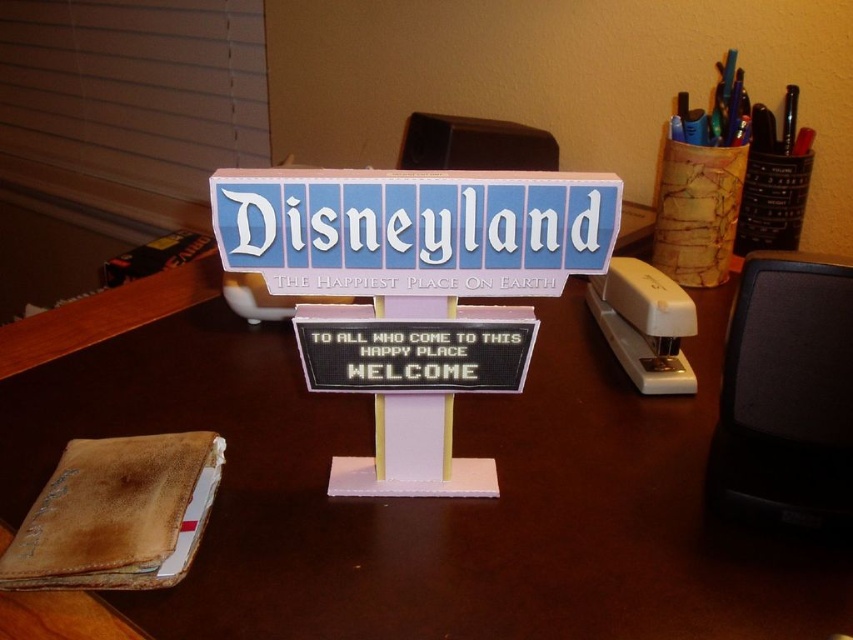
Based on the photo, you are trying to place your leather wallet at lower left on the wooden desk at center. Can you confirm if the desk is wide enough to accommodate the wallet?

The wooden desk at center might be wider than leather wallet at lower left, so there is a possibility that the desk is wide enough to place the wallet.

You are a photographer setting up a tripod to take a photo of the Disneyland sign model. The tripod requires a flat surface that is at least as tall as the leather wallet at lower left. Can you place the tripod on the wooden desk at center?

The wooden desk at center is much taller than the leather wallet at lower left, so yes, the tripod can be placed on the wooden desk at center since its height meets the requirement.

You are organizing your desk and need to place a new item between the wooden desk at center and the white plastic stapler at right. Which object should you place the item closer to if you want it to be closer to the taller object?

You should place the item closer to the wooden desk at center because it is taller than the white plastic stapler at right.